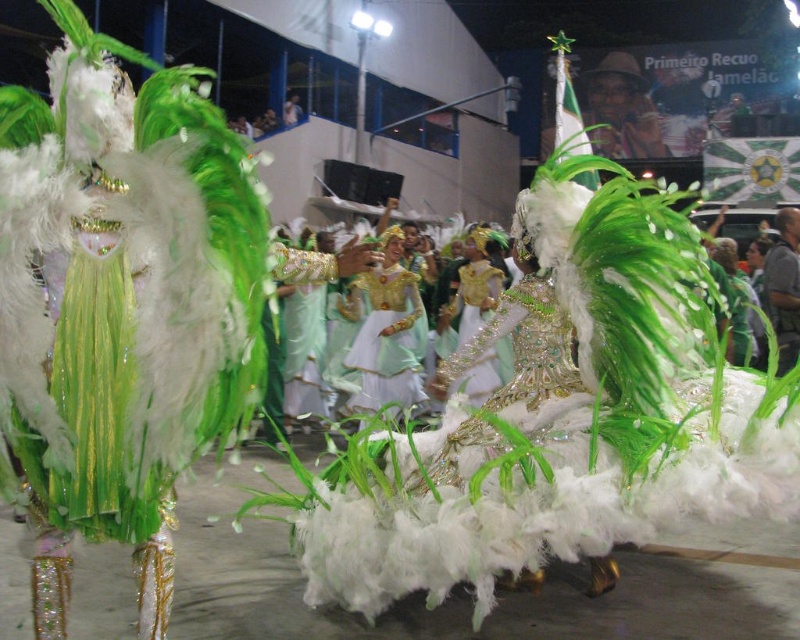
Question: Among these objects, which one is nearest to the camera?

Choices:
 (A) green feathered costume at center
 (B) matte green dress at center
 (C) shiny gold dress at center

Answer: (A)

Question: Which point appears closest to the camera in this image?

Choices:
 (A) (362, 392)
 (B) (216, 436)
 (C) (458, 333)

Answer: (B)

Question: From the image, what is the correct spatial relationship of green feathered costume at center in relation to matte green dress at center?

Choices:
 (A) right
 (B) left

Answer: (B)

Question: Can you confirm if green feathered costume at center is positioned to the left of matte green dress at center?

Choices:
 (A) no
 (B) yes

Answer: (B)

Question: From the image, what is the correct spatial relationship of matte green dress at center in relation to shiny gold dress at center?

Choices:
 (A) below
 (B) above

Answer: (A)

Question: Which is farther from the matte green dress at center?

Choices:
 (A) green feathered costume at center
 (B) shiny gold dress at center

Answer: (A)